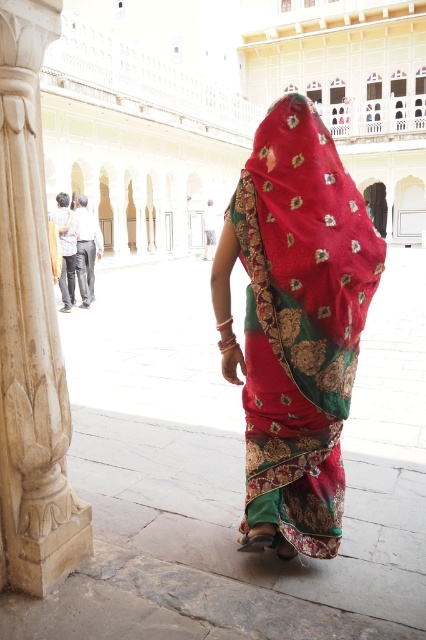
You are standing in the courtyard and want to pass between the white marble pillar at left and the matte black robe at left. Which object should you avoid touching if you want to maintain a 10 cm distance on both sides?

The white marble pillar at left is thinner than the matte black robe at left, so you should avoid touching the matte black robe at left to maintain a 10 cm distance on both sides since it has a larger width.